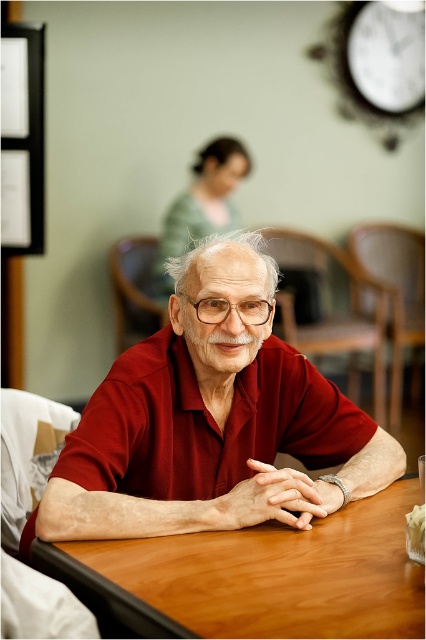
Question: Does white plastic clock at upper right appear under matte green sweater at upper center?

Choices:
 (A) yes
 (B) no

Answer: (B)

Question: Which point is farther from the camera taking this photo?

Choices:
 (A) [181, 595]
 (B) [411, 88]
 (C) [213, 305]

Answer: (B)

Question: Considering the real-world distances, which object is farthest from the transparent plastic glasses at center?

Choices:
 (A) white plastic clock at upper right
 (B) wooden table at center

Answer: (A)

Question: Is the position of wooden table at center less distant than that of transparent plastic glasses at center?

Choices:
 (A) no
 (B) yes

Answer: (B)

Question: Does matte green sweater at upper center have a lesser width compared to transparent plastic glasses at center?

Choices:
 (A) no
 (B) yes

Answer: (A)

Question: Which object appears farthest from the camera in this image?

Choices:
 (A) matte red shirt at center
 (B) white plastic clock at upper right

Answer: (B)